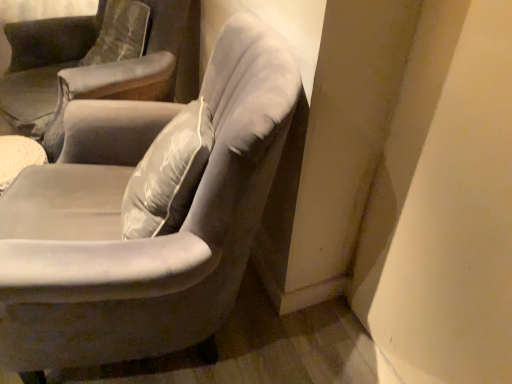
Question: Is velvet gray armchair at center, placed as the first chair when sorted from front to back, further to camera compared to velvet gray armchair at upper left, which appears as the second chair when viewed from the front?

Choices:
 (A) no
 (B) yes

Answer: (A)

Question: Is velvet gray armchair at center, the second chair when ordered from back to front, located outside velvet gray armchair at upper left, the 1th chair in the back-to-front sequence?

Choices:
 (A) yes
 (B) no

Answer: (A)

Question: From a real-world perspective, is velvet gray armchair at center, the second chair when ordered from back to front, on velvet gray armchair at upper left, the 1th chair in the back-to-front sequence?

Choices:
 (A) no
 (B) yes

Answer: (A)

Question: Is velvet gray armchair at center, the second chair when ordered from back to front, oriented towards velvet gray armchair at upper left, which appears as the second chair when viewed from the front?

Choices:
 (A) yes
 (B) no

Answer: (B)

Question: Is velvet gray armchair at center, the second chair when ordered from back to front, directly adjacent to velvet gray armchair at upper left, which appears as the second chair when viewed from the front?

Choices:
 (A) no
 (B) yes

Answer: (A)

Question: Considering the relative sizes of velvet gray armchair at center, the second chair when ordered from back to front, and velvet gray armchair at upper left, the 1th chair in the back-to-front sequence, in the image provided, is velvet gray armchair at center, the second chair when ordered from back to front, shorter than velvet gray armchair at upper left, the 1th chair in the back-to-front sequence,?

Choices:
 (A) yes
 (B) no

Answer: (B)

Question: From the image's perspective, is velvet gray armchair at upper left, the 1th chair in the back-to-front sequence, below velvet gray armchair at center, placed as the first chair when sorted from front to back?

Choices:
 (A) yes
 (B) no

Answer: (B)

Question: From a real-world perspective, is velvet gray armchair at upper left, which appears as the second chair when viewed from the front, on top of velvet gray armchair at center, placed as the first chair when sorted from front to back?

Choices:
 (A) no
 (B) yes

Answer: (B)

Question: Is velvet gray armchair at upper left, which appears as the second chair when viewed from the front, at the left side of velvet gray armchair at center, placed as the first chair when sorted from front to back?

Choices:
 (A) yes
 (B) no

Answer: (A)

Question: Is the depth of velvet gray armchair at upper left, which appears as the second chair when viewed from the front, less than that of velvet gray armchair at center, placed as the first chair when sorted from front to back?

Choices:
 (A) no
 (B) yes

Answer: (A)

Question: Is velvet gray armchair at upper left, which appears as the second chair when viewed from the front, wider than velvet gray armchair at center, the second chair when ordered from back to front?

Choices:
 (A) no
 (B) yes

Answer: (B)

Question: From a real-world perspective, is velvet gray armchair at upper left, the 1th chair in the back-to-front sequence, positioned under velvet gray armchair at center, placed as the first chair when sorted from front to back, based on gravity?

Choices:
 (A) no
 (B) yes

Answer: (A)

Question: In terms of width, does velvet gray armchair at upper left, which appears as the second chair when viewed from the front, look wider or thinner when compared to velvet gray armchair at center, placed as the first chair when sorted from front to back?

Choices:
 (A) wide
 (B) thin

Answer: (A)